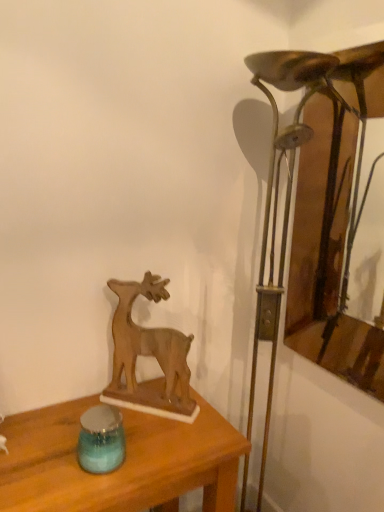
Identify the location of unoccupied region to the right of blue glass candle holder at lower left. The width and height of the screenshot is (384, 512). (157, 456).